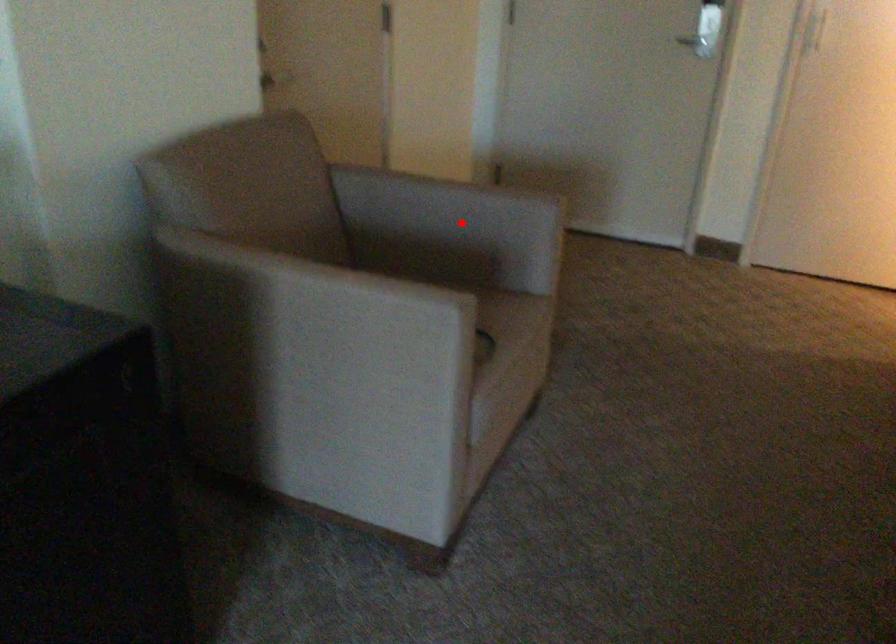
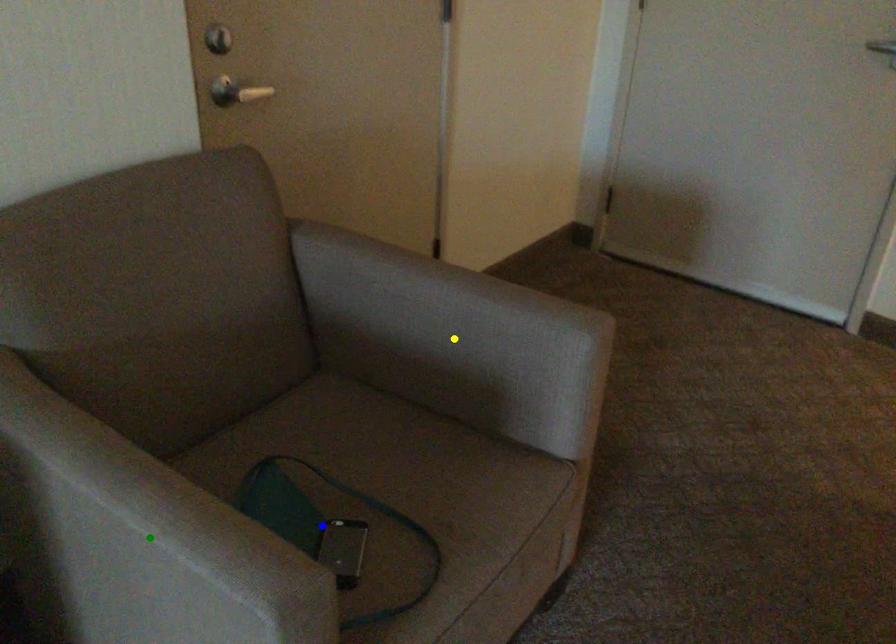
Question: I am providing you with two images of the same scene from different viewpoints. A red point is marked on the first image. You are given multiple points on the second image. Which spot in image 2 lines up with the point in image 1?

Choices:
 (A) blue point
 (B) yellow point
 (C) green point

Answer: (B)